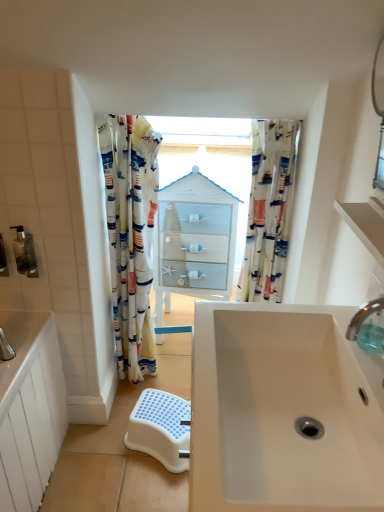
Question: Is white plastic step stool at lower center taller or shorter than printed fabric curtain at center, marked as the first curtain in a right-to-left arrangement?

Choices:
 (A) short
 (B) tall

Answer: (A)

Question: Looking at the image, does white plastic step stool at lower center seem bigger or smaller compared to printed fabric curtain at center, acting as the 2th curtain starting from the left?

Choices:
 (A) big
 (B) small

Answer: (B)

Question: Estimate the real-world distances between objects in this image. Which object is closer to the white matte sink at center?

Choices:
 (A) white plastic step stool at lower center
 (B) translucent plastic soap dispenser at left, positioned as the second toiletry in left-to-right order
 (C) white matte shelf at upper right
 (D) translucent plastic soap dispenser at left, acting as the first toiletry starting from the left
 (E) printed fabric shower curtain at left, placed as the 1th curtain when sorted from left to right

Answer: (C)

Question: Considering the real-world distances, which object is farthest from the white plastic step stool at lower center?

Choices:
 (A) printed fabric curtain at center, acting as the 2th curtain starting from the left
 (B) translucent plastic soap dispenser at left, the first toiletry when ordered from right to left
 (C) white matte shelf at upper right
 (D) clear plastic tap at upper right
 (E) white glossy cabinet at center

Answer: (C)